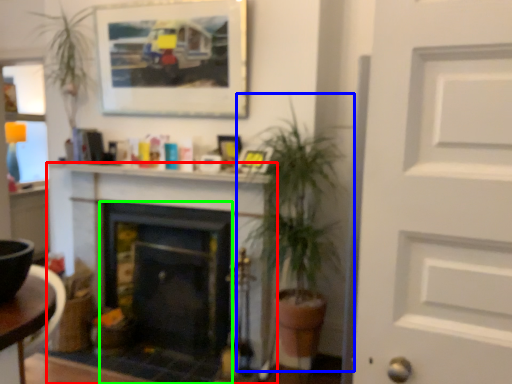
Question: Which is nearer to the fireplace (highlighted by a red box)? houseplant (highlighted by a blue box) or fireplace (highlighted by a green box).

Choices:
 (A) houseplant
 (B) fireplace

Answer: (B)